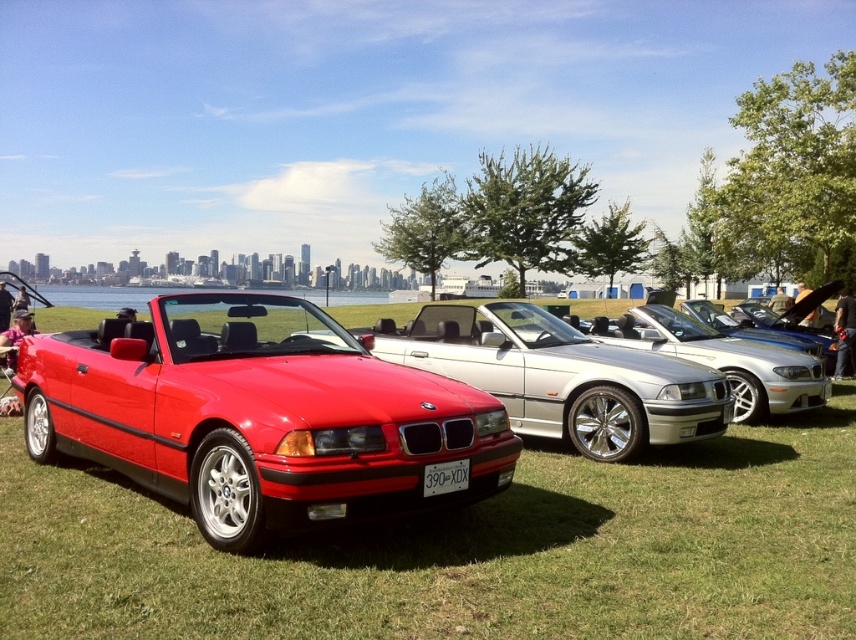
Is matte red convertible at left thinner than shiny metallic silver convertible at center?

In fact, matte red convertible at left might be wider than shiny metallic silver convertible at center.

Can you confirm if matte red convertible at left is bigger than shiny metallic silver convertible at center?

Yes, matte red convertible at left is bigger than shiny metallic silver convertible at center.

Looking at this image, measure the distance between point (408,406) and camera.

A distance of 4.67 meters exists between point (408,406) and camera.

This screenshot has height=640, width=856. Find the location of `matte red convertible at left`. matte red convertible at left is located at coordinates (259, 417).